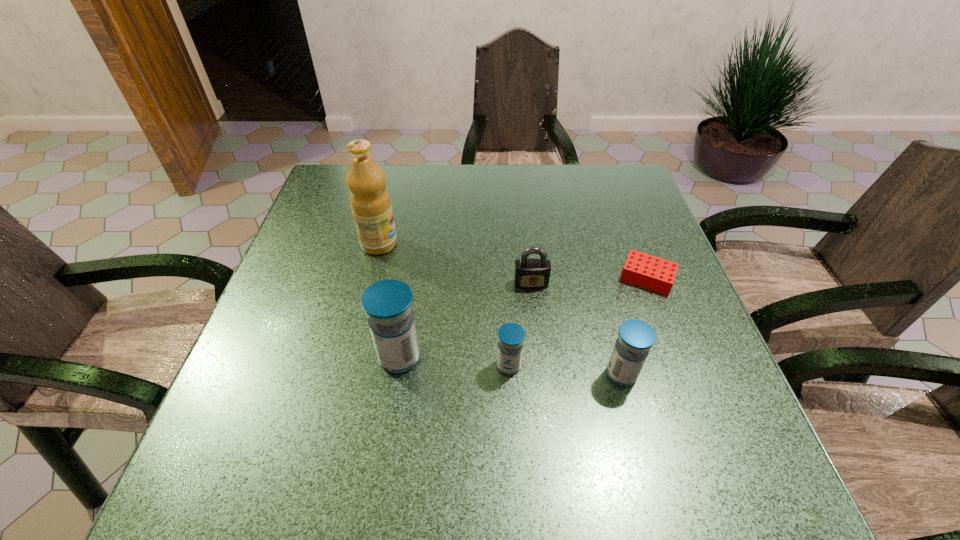
Image resolution: width=960 pixels, height=540 pixels. What are the coordinates of `free region at the near edge of the desktop` in the screenshot? It's located at (608, 411).

The image size is (960, 540). Identify the location of vacant space at the left edge. (314, 219).

This screenshot has height=540, width=960. In the image, there is a desktop. What are the coordinates of `vacant space at the right edge` in the screenshot? It's located at (642, 297).

Locate an element on the screen. The width and height of the screenshot is (960, 540). vacant space at the far left corner is located at coordinates tap(330, 180).

At what (x,y) coordinates should I click in order to perform the action: click on vacant space at the near left corner of the desktop. Please return your answer as a coordinate pair (x, y). Looking at the image, I should click on (249, 416).

The width and height of the screenshot is (960, 540). In the image, there is a desktop. Identify the location of free region at the far right corner. (603, 181).

Locate an element on the screen. The width and height of the screenshot is (960, 540). free space between the rightmost medicine and the padlock is located at coordinates (576, 329).

The height and width of the screenshot is (540, 960). In order to click on vacant space in between the rightmost medicine and the padlock in this screenshot , I will do `click(576, 329)`.

Where is `free space that is in between the second tallest medicine and the padlock`? The width and height of the screenshot is (960, 540). free space that is in between the second tallest medicine and the padlock is located at coordinates (576, 329).

At what (x,y) coordinates should I click in order to perform the action: click on free space between the second medicine from left to right and the padlock. Please return your answer as a coordinate pair (x, y). Looking at the image, I should click on (520, 325).